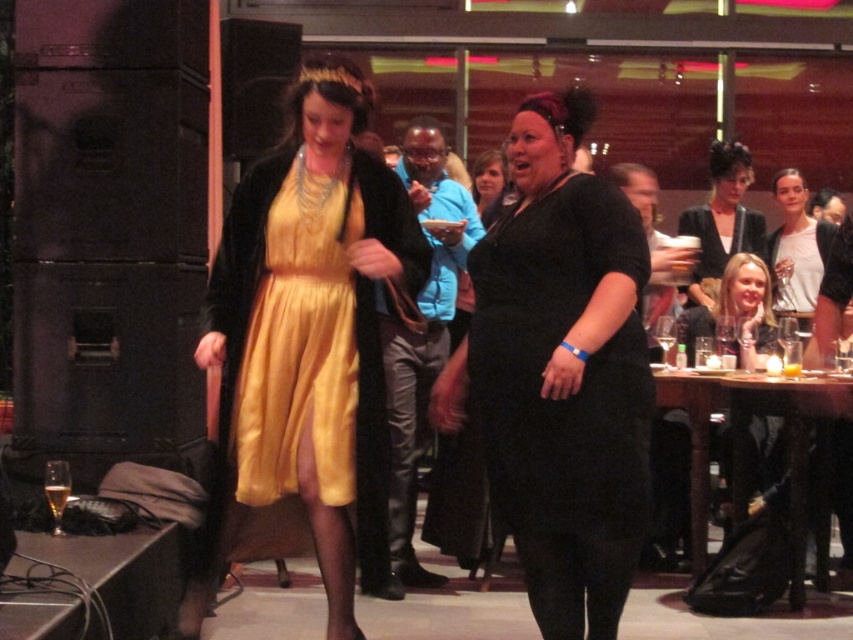
Between point (540, 307) and point (415, 564), which one is positioned in front?

Positioned in front is point (540, 307).

Does point (608, 188) come behind point (426, 582)?

No, it is not.

Where is `black matte dress at center`? Image resolution: width=853 pixels, height=640 pixels. black matte dress at center is located at coordinates (560, 372).

Does blue quilted jacket at center have a greater height compared to matte black dress at center?

Indeed, blue quilted jacket at center has a greater height compared to matte black dress at center.

Locate an element on the screen. The width and height of the screenshot is (853, 640). blue quilted jacket at center is located at coordinates (421, 328).

Where is `blue quilted jacket at center`? The height and width of the screenshot is (640, 853). blue quilted jacket at center is located at coordinates point(421,328).

Does black leather pants at center appear under matte black dress at upper right?

Correct, black leather pants at center is located below matte black dress at upper right.

Can you confirm if black leather pants at center is positioned to the right of matte black dress at upper right?

Incorrect, black leather pants at center is not on the right side of matte black dress at upper right.

Measure the distance between point (407, 442) and camera.

Point (407, 442) and camera are 4.05 meters apart.

Locate an element on the screen. black leather pants at center is located at coordinates (408, 433).